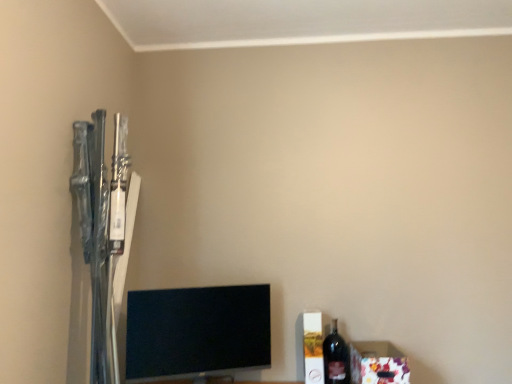
What is the approximate width of black glossy tv at lower center?

black glossy tv at lower center is 7.18 inches wide.

In order to face floral paper box at lower right, should I rotate leftwards or rightwards?

To align with it, rotate right about 16.163°.

This screenshot has width=512, height=384. In order to click on floral paper box at lower right in this screenshot , I will do `click(378, 363)`.

Locate an element on the screen. This screenshot has height=384, width=512. dark glass bottle at lower right is located at coordinates (336, 358).

Would you say floral paper box at lower right is inside or outside black glossy tv at lower center?

floral paper box at lower right exists outside the volume of black glossy tv at lower center.

In the image, is floral paper box at lower right positioned in front of or behind black glossy tv at lower center?

In the image, floral paper box at lower right appears behind black glossy tv at lower center.

Is floral paper box at lower right placed right next to black glossy tv at lower center?

No, floral paper box at lower right is not beside black glossy tv at lower center.

Looking at this image, is black glossy tv at lower center completely or partially inside dark glass bottle at lower right?

No, black glossy tv at lower center is not inside dark glass bottle at lower right.

Identify the location of bottle behind the black glossy tv at lower center. (336, 358).

In terms of width, does dark glass bottle at lower right look wider or thinner when compared to black glossy tv at lower center?

Clearly, dark glass bottle at lower right has less width compared to black glossy tv at lower center.

Considering the relative sizes of dark glass bottle at lower right and black glossy tv at lower center in the image provided, is dark glass bottle at lower right taller than black glossy tv at lower center?

Incorrect, the height of dark glass bottle at lower right is not larger of that of black glossy tv at lower center.

Choose the correct answer: Is floral paper box at lower right inside dark glass bottle at lower right or outside it?

floral paper box at lower right lies outside dark glass bottle at lower right.

Can you confirm if floral paper box at lower right is thinner than dark glass bottle at lower right?

In fact, floral paper box at lower right might be wider than dark glass bottle at lower right.

From a real-world perspective, which is physically above, floral paper box at lower right or dark glass bottle at lower right?

dark glass bottle at lower right, from a real-world perspective.

Is point (369, 369) positioned behind point (342, 377)?

Yes, it is behind point (342, 377).

Is floral paper box at lower right located within dark glass bottle at lower right?

Definitely not — floral paper box at lower right is not inside dark glass bottle at lower right.

Could you tell me if dark glass bottle at lower right is facing floral paper box at lower right?

No, dark glass bottle at lower right is not turned towards floral paper box at lower right.

Consider the image. Based on their sizes in the image, would you say dark glass bottle at lower right is bigger or smaller than floral paper box at lower right?

In the image, dark glass bottle at lower right appears to be smaller than floral paper box at lower right.

From the image's perspective, which is below, dark glass bottle at lower right or floral paper box at lower right?

floral paper box at lower right is shown below in the image.

Considering the sizes of objects black glossy tv at lower center and floral paper box at lower right in the image provided, who is shorter, black glossy tv at lower center or floral paper box at lower right?

floral paper box at lower right.

In the scene shown: Between black glossy tv at lower center and floral paper box at lower right, which one has larger size?

Bigger between the two is black glossy tv at lower center.

From a real-world perspective, is black glossy tv at lower center physically above floral paper box at lower right?

Yes.

From the image's perspective, is black glossy tv at lower center located beneath floral paper box at lower right?

No.

Looking at this image, are black glossy tv at lower center and dark glass bottle at lower right located far from each other?

No, there isn't a large distance between black glossy tv at lower center and dark glass bottle at lower right.

Considering the points (137, 320) and (337, 364), which point is behind, point (137, 320) or point (337, 364)?

Point (337, 364)

From the image's perspective, is black glossy tv at lower center located above or below dark glass bottle at lower right?

Based on their image positions, black glossy tv at lower center is located above dark glass bottle at lower right.

From a real-world perspective, which is physically below, black glossy tv at lower center or dark glass bottle at lower right?

From a 3D spatial view, dark glass bottle at lower right is below.

At what (x,y) coordinates should I click in order to perform the action: click on box located underneath the black glossy tv at lower center (from a real-world perspective). Please return your answer as a coordinate pair (x, y). This screenshot has width=512, height=384. Looking at the image, I should click on (378, 363).

Identify the location of bottle on the right of the black glossy tv at lower center. (336, 358).

Based on their spatial positions, is dark glass bottle at lower right or black glossy tv at lower center closer to floral paper box at lower right?

dark glass bottle at lower right is positioned closer to the anchor floral paper box at lower right.

Based on their spatial positions, is floral paper box at lower right or dark glass bottle at lower right closer to black glossy tv at lower center?

dark glass bottle at lower right lies closer to black glossy tv at lower center than the other object.

From the image, which object appears to be nearer to dark glass bottle at lower right, black glossy tv at lower center or floral paper box at lower right?

floral paper box at lower right is positioned closer to the anchor dark glass bottle at lower right.

Which object lies nearer to the anchor point black glossy tv at lower center, dark glass bottle at lower right or floral paper box at lower right?

The object closer to black glossy tv at lower center is dark glass bottle at lower right.

From the image, which object appears to be farther from floral paper box at lower right, black glossy tv at lower center or dark glass bottle at lower right?

Based on the image, black glossy tv at lower center appears to be further to floral paper box at lower right.

Based on the photo, considering their positions, is floral paper box at lower right positioned further to dark glass bottle at lower right than black glossy tv at lower center?

black glossy tv at lower center is positioned further to the anchor dark glass bottle at lower right.

Locate an element on the screen. The image size is (512, 384). bottle between black glossy tv at lower center and floral paper box at lower right is located at coordinates (336, 358).